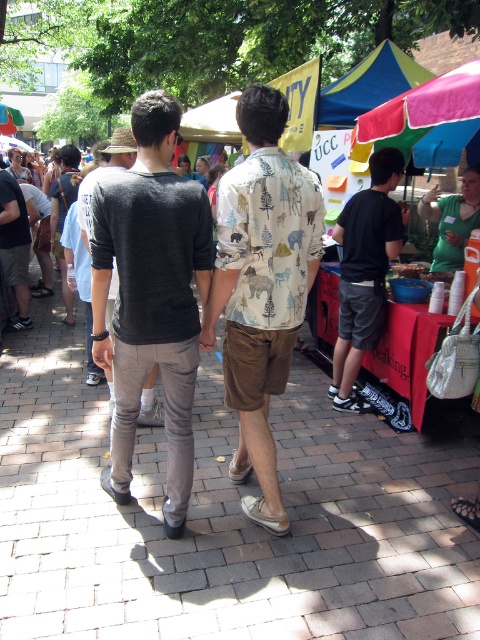
Question: Estimate the real-world distances between objects in this image. Which object is closer to the dark gray sweater at left?

Choices:
 (A) dark gray cotton shirt at center
 (B) brick pavement at center
 (C) gray cotton shirt at center
 (D) dark gray t-shirt at center

Answer: (C)

Question: Which object is closer to the camera taking this photo?

Choices:
 (A) brick pavement at center
 (B) dark gray t-shirt at center

Answer: (A)

Question: Is brick pavement at center to the left of printed cotton shirt at center from the viewer's perspective?

Choices:
 (A) no
 (B) yes

Answer: (B)

Question: Can you confirm if brick pavement at center is positioned to the right of printed cotton shirt at center?

Choices:
 (A) no
 (B) yes

Answer: (A)

Question: Can you confirm if brick pavement at center is positioned above dark gray sweater at left?

Choices:
 (A) no
 (B) yes

Answer: (A)

Question: Among these points, which one is nearest to the camera?

Choices:
 (A) (12, 211)
 (B) (384, 292)
 (C) (133, 404)

Answer: (C)